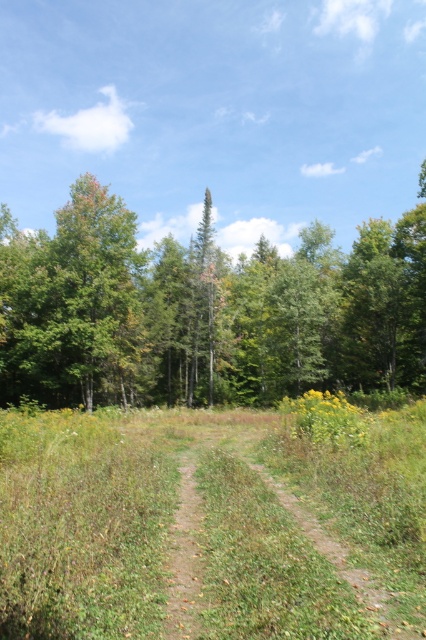
Question: Can you confirm if green grassy path at center is thinner than green leafy tree at center?

Choices:
 (A) yes
 (B) no

Answer: (A)

Question: Does green leafy tree at center appear on the left side of yellow-green textured wildflower at right?

Choices:
 (A) no
 (B) yes

Answer: (B)

Question: Can you confirm if green leafy tree at center is positioned to the right of yellow-green textured wildflower at right?

Choices:
 (A) yes
 (B) no

Answer: (B)

Question: Which of the following is the farthest from the observer?

Choices:
 (A) yellow-green textured wildflower at right
 (B) green grassy path at center

Answer: (A)

Question: Which object is the closest to the yellow-green textured wildflower at right?

Choices:
 (A) green grassy path at center
 (B) green leafy tree at center

Answer: (A)

Question: Which object is closer to the camera taking this photo?

Choices:
 (A) green leafy tree at center
 (B) green grassy path at center
 (C) yellow-green textured wildflower at right

Answer: (B)